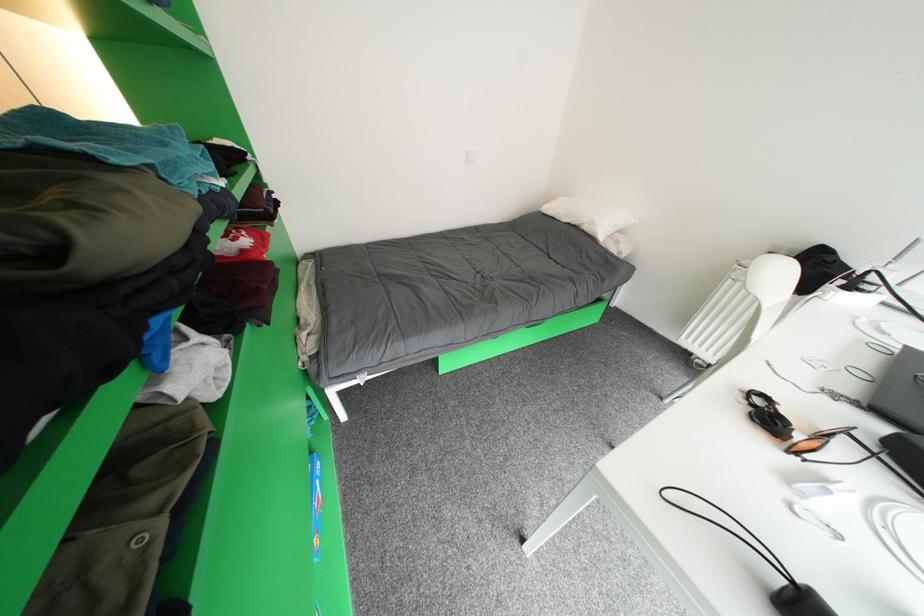
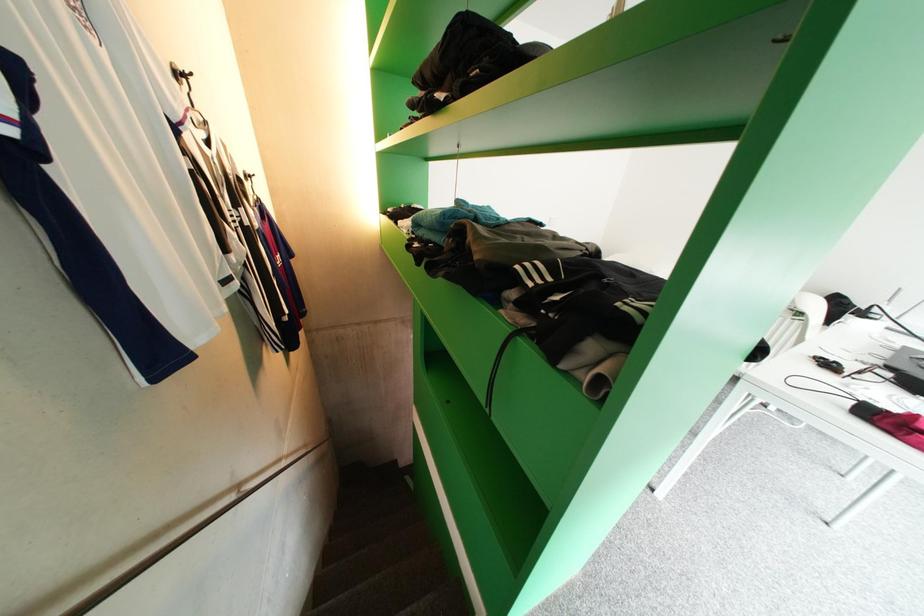
Question: How did the camera likely rotate?

Choices:
 (A) Left
 (B) Right
 (C) Up
 (D) Down

Answer: (C)